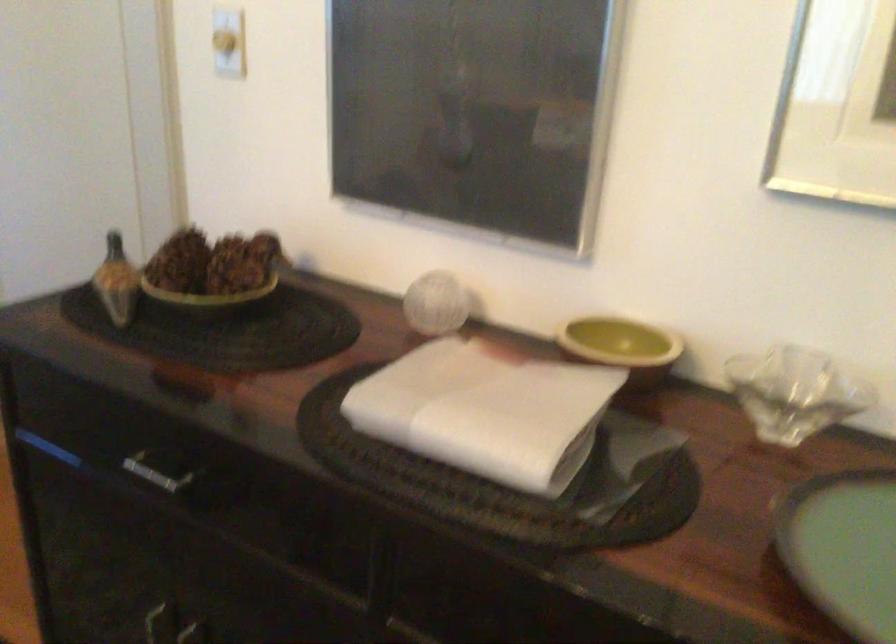
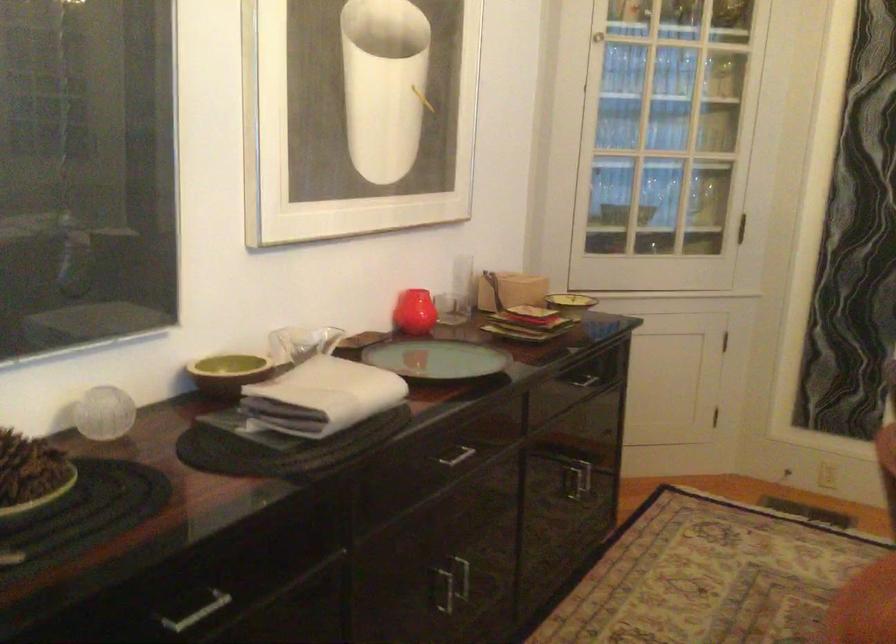
The point at (407, 283) is marked in the first image. Where is the corresponding point in the second image?

(104, 413)